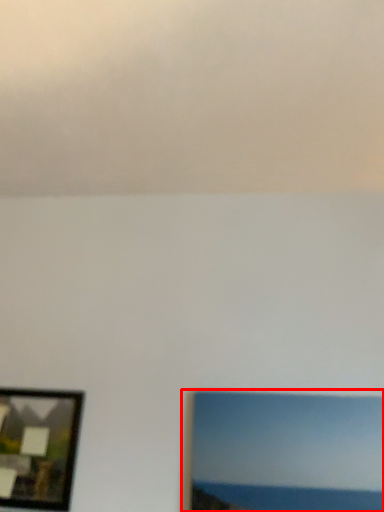
Question: From the image's perspective, where is picture frame (annotated by the red box) located in relation to picture frame in the image?

Choices:
 (A) below
 (B) above

Answer: (B)